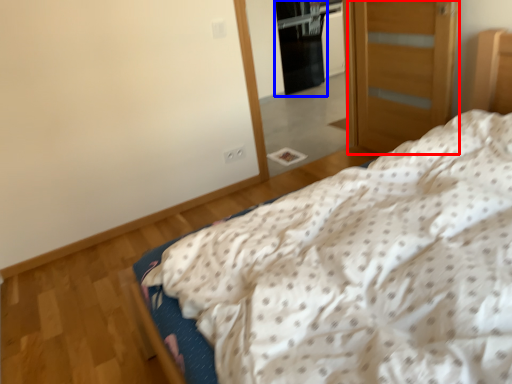
Question: Which point is further to the camera, door (highlighted by a red box) or screen door (highlighted by a blue box)?

Choices:
 (A) door
 (B) screen door

Answer: (B)